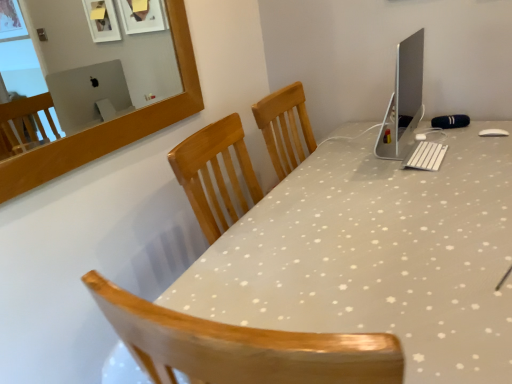
Question: From a real-world perspective, relative to sleek silver monitor at upper right, is white plastic keyboard at center vertically above or below?

Choices:
 (A) above
 (B) below

Answer: (B)

Question: Is white plastic keyboard at center in front of or behind sleek silver monitor at upper right in the image?

Choices:
 (A) front
 (B) behind

Answer: (B)

Question: Which of these objects is positioned closest to the sleek silver monitor at upper right?

Choices:
 (A) white glossy desk at center
 (B) white plastic keyboard at center

Answer: (B)

Question: Estimate the real-world distances between objects in this image. Which object is farther from the white glossy desk at center?

Choices:
 (A) white plastic keyboard at center
 (B) sleek silver monitor at upper right

Answer: (B)